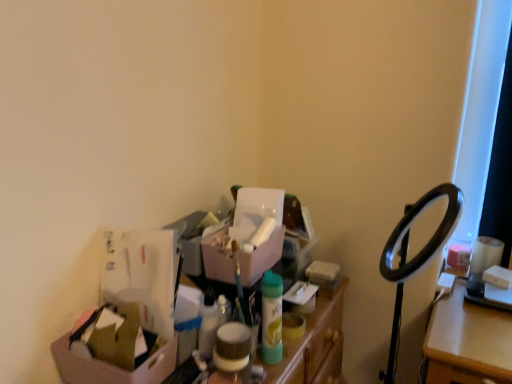
Question: Visually, is matte plastic storage bin at center positioned to the left or to the right of cardboard box at lower left, which is the second box in right-to-left order?

Choices:
 (A) right
 (B) left

Answer: (A)

Question: Based on their sizes in the image, would you say matte plastic storage bin at center is bigger or smaller than cardboard box at lower left, the 1th box when ordered from front to back?

Choices:
 (A) big
 (B) small

Answer: (A)

Question: Which of these objects is positioned closest to the cardboard box at lower left, acting as the 1th box starting from the left?

Choices:
 (A) matte pink box at center, the second box when ordered from front to back
 (B) matte plastic storage bin at center

Answer: (B)

Question: Estimate the real-world distances between objects in this image. Which object is closer to the matte pink box at center, positioned as the first box in top-to-bottom order?

Choices:
 (A) cardboard box at lower left, the 1th box when ordered from front to back
 (B) matte plastic storage bin at center

Answer: (B)